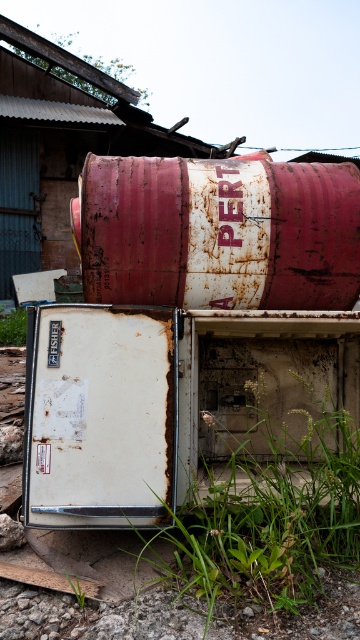
Question: Is rusty white refrigerator at lower left positioned at the back of green grass at lower left?

Choices:
 (A) no
 (B) yes

Answer: (A)

Question: Can you confirm if rusty metal barrel at upper center is positioned below green grass at lower center?

Choices:
 (A) no
 (B) yes

Answer: (A)

Question: Which point is farther to the camera?

Choices:
 (A) rusty white refrigerator at lower left
 (B) green grass at lower left

Answer: (B)

Question: Which object appears closest to the camera in this image?

Choices:
 (A) green grass at lower center
 (B) green grass at lower left

Answer: (A)

Question: Which of the following is the farthest from the observer?

Choices:
 (A) green grass at lower center
 (B) rusty metal barrel at upper center

Answer: (B)

Question: Does rusty white refrigerator at lower left have a lesser width compared to green grass at lower left?

Choices:
 (A) yes
 (B) no

Answer: (B)